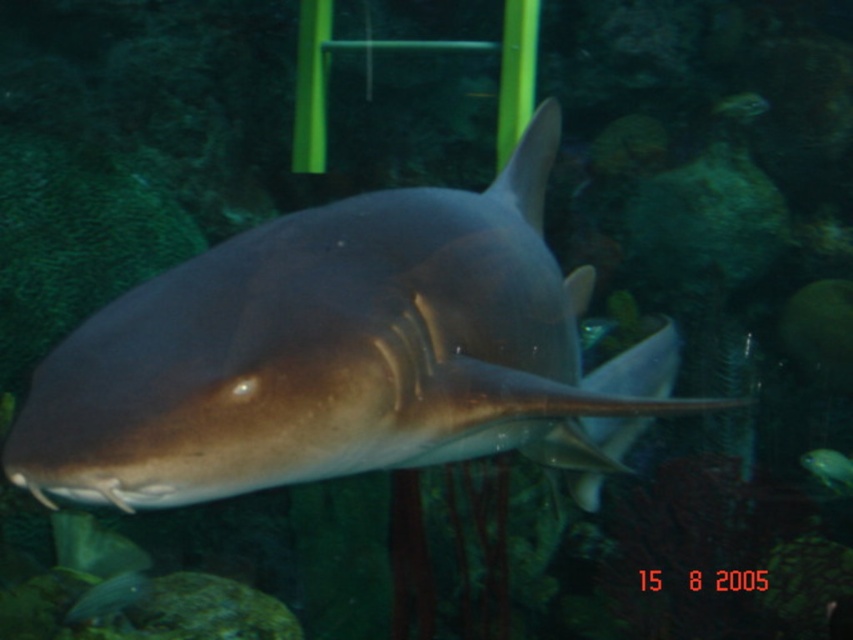
You are an aquarium maintenance worker. You need to identify which fish is smaller between the shiny silver fish at lower left and the shiny blue fish at center. Which one should you report?

The shiny silver fish at lower left is shorter than the shiny blue fish at center, so you should report the shiny silver fish at lower left as the smaller one.

You are an aquarium visitor observing the shark and the two fish. Which fish is smaller between the shiny silver fish at lower left and the shiny blue fish at center?

The shiny silver fish at lower left is smaller than the shiny blue fish at center.

You are an aquarium designer planning to install a new tank divider between the smooth gray shark at center and the shiny blue fish at center. Since both are at the center, how can you ensure the divider doesn

The smooth gray shark at center is taller than the shiny blue fish at center, so the divider should be at least as tall as the shark to prevent it from jumping over.